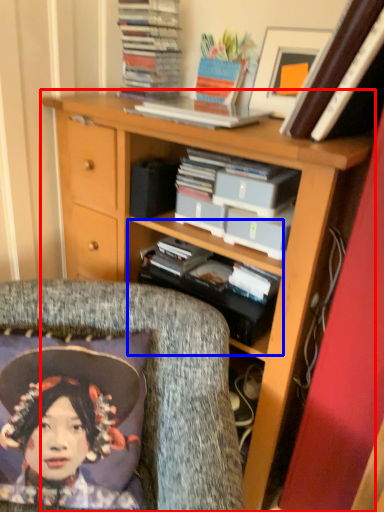
Question: Among these objects, which one is nearest to the camera, bookcase (highlighted by a red box) or shelf (highlighted by a blue box)?

Choices:
 (A) bookcase
 (B) shelf

Answer: (A)